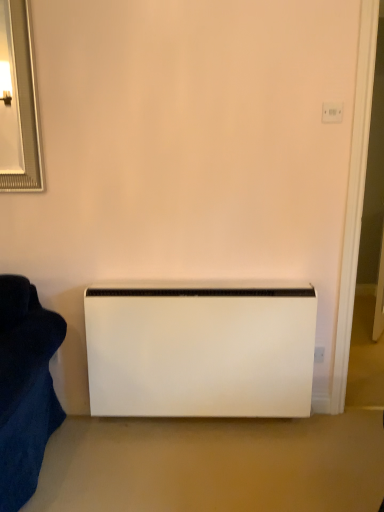
Describe the element at coordinates (332, 112) in the screenshot. I see `white plastic electric outlet at upper right` at that location.

Find the location of a particular element. The width and height of the screenshot is (384, 512). white plastic electric outlet at upper right is located at coordinates (332, 112).

Image resolution: width=384 pixels, height=512 pixels. Describe the element at coordinates (200, 350) in the screenshot. I see `white matte heater at center` at that location.

At what (x,y) coordinates should I click in order to perform the action: click on white matte heater at center. Please return your answer as a coordinate pair (x, y). The image size is (384, 512). Looking at the image, I should click on (200, 350).

Image resolution: width=384 pixels, height=512 pixels. Identify the location of white plastic electric outlet at upper right. (332, 112).

Considering the relative positions of white matte heater at center and white plastic electric outlet at upper right in the image provided, is white matte heater at center to the right of white plastic electric outlet at upper right from the viewer's perspective?

No, white matte heater at center is not to the right of white plastic electric outlet at upper right.

Is white matte heater at center positioned behind white plastic electric outlet at upper right?

Yes, white matte heater at center is behind white plastic electric outlet at upper right.

Does point (182, 298) appear closer or farther from the camera than point (323, 112)?

Point (182, 298) is positioned farther from the camera compared to point (323, 112).

From the image's perspective, between white matte heater at center and white plastic electric outlet at upper right, who is located below?

From the image's view, white matte heater at center is below.

From a real-world perspective, which object stands above the other?

white plastic electric outlet at upper right, from a real-world perspective.

Does white matte heater at center have a greater width compared to white plastic electric outlet at upper right?

Yes.

Can you confirm if white matte heater at center is taller than white plastic electric outlet at upper right?

Indeed, white matte heater at center has a greater height compared to white plastic electric outlet at upper right.

Is white matte heater at center smaller than white plastic electric outlet at upper right?

No.

Is white matte heater at center located outside white plastic electric outlet at upper right?

Yes, white matte heater at center is located beyond the bounds of white plastic electric outlet at upper right.

Is the surface of white matte heater at center in direct contact with white plastic electric outlet at upper right?

No, white matte heater at center is not with white plastic electric outlet at upper right.

Looking at this image, is white matte heater at center aimed at white plastic electric outlet at upper right?

No, white matte heater at center is not oriented towards white plastic electric outlet at upper right.

Image resolution: width=384 pixels, height=512 pixels. Find the location of `appliance below the white plastic electric outlet at upper right (from the image's perspective)`. appliance below the white plastic electric outlet at upper right (from the image's perspective) is located at coordinates (200, 350).

Based on their positions, is white plastic electric outlet at upper right located to the left or right of white matte heater at center?

white plastic electric outlet at upper right is to the right of white matte heater at center.

Is white plastic electric outlet at upper right positioned behind white matte heater at center?

No, white plastic electric outlet at upper right is in front of white matte heater at center.

Is point (341, 114) positioned before point (227, 298)?

That is True.

From the image's perspective, would you say white plastic electric outlet at upper right is positioned over white matte heater at center?

Yes.

From a real-world perspective, is white plastic electric outlet at upper right under white matte heater at center?

Incorrect, from a real-world perspective, white plastic electric outlet at upper right is higher than white matte heater at center.

Which object is wider, white plastic electric outlet at upper right or white matte heater at center?

With larger width is white matte heater at center.

Is white plastic electric outlet at upper right taller than white matte heater at center?

No, white plastic electric outlet at upper right is not taller than white matte heater at center.

Can you confirm if white plastic electric outlet at upper right is bigger than white matte heater at center?

No, white plastic electric outlet at upper right is not bigger than white matte heater at center.

Is white plastic electric outlet at upper right situated inside white matte heater at center or outside?

white plastic electric outlet at upper right is not inside white matte heater at center, it's outside.

Would you consider white plastic electric outlet at upper right to be distant from white matte heater at center?

Indeed, white plastic electric outlet at upper right is not near white matte heater at center.

Is white plastic electric outlet at upper right aimed at white matte heater at center?

No.

How different are the orientations of white plastic electric outlet at upper right and white matte heater at center in degrees?

0.047 degrees.

How much distance is there between white plastic electric outlet at upper right and white matte heater at center?

white plastic electric outlet at upper right and white matte heater at center are 1.16 meters apart.

This screenshot has height=512, width=384. Identify the location of electric outlet above the white matte heater at center (from the image's perspective). (332, 112).

The image size is (384, 512). Find the location of `appliance on the left side of white plastic electric outlet at upper right`. appliance on the left side of white plastic electric outlet at upper right is located at coordinates (200, 350).

At what (x,y) coordinates should I click in order to perform the action: click on electric outlet on the right of white matte heater at center. Please return your answer as a coordinate pair (x, y). Image resolution: width=384 pixels, height=512 pixels. Looking at the image, I should click on (332, 112).